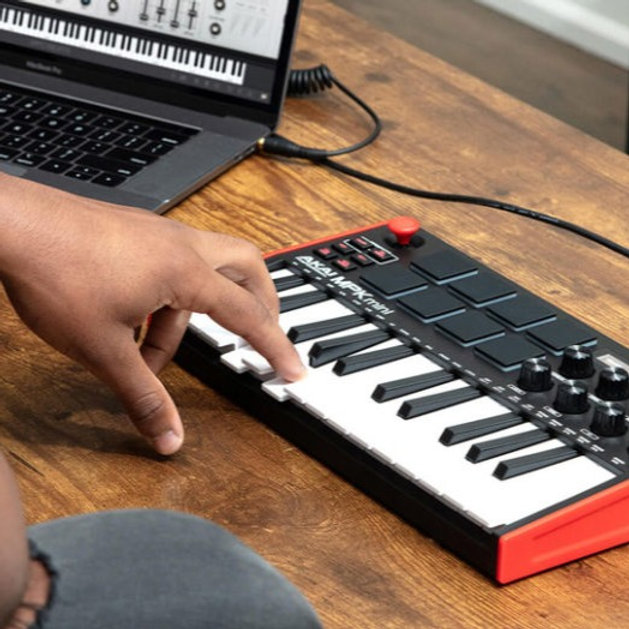
You are a GUI agent. You are given a task and a screenshot of the screen. Output one action in this format:
    pyautogui.click(x=<x>, y=<y>)
    Task: Click on the physical black piano keys
    The height and width of the screenshot is (629, 629).
    Given the screenshot: What is the action you would take?
    pyautogui.click(x=289, y=280), pyautogui.click(x=304, y=297), pyautogui.click(x=318, y=321), pyautogui.click(x=334, y=341), pyautogui.click(x=355, y=363), pyautogui.click(x=406, y=389), pyautogui.click(x=435, y=401), pyautogui.click(x=472, y=428), pyautogui.click(x=502, y=458), pyautogui.click(x=490, y=448)